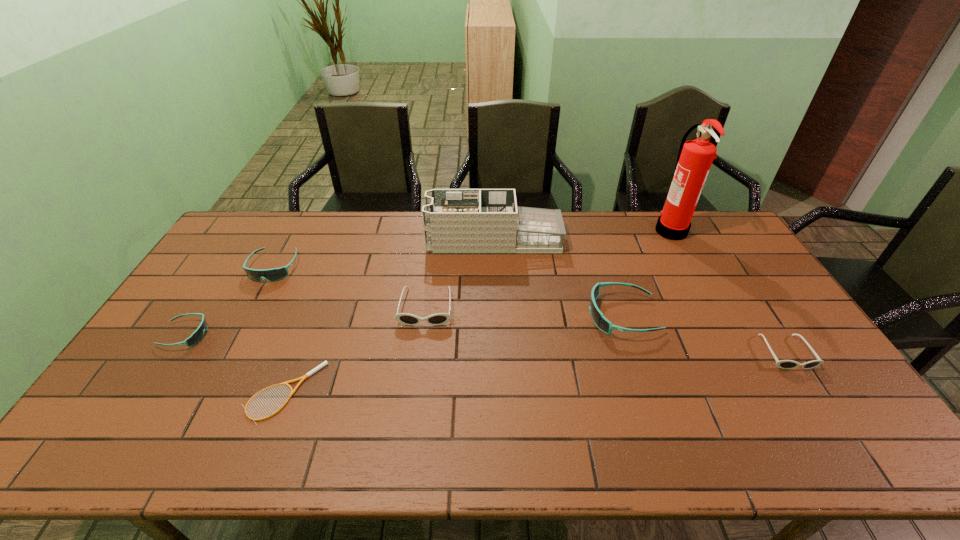
Identify the location of vacant area between the seventh shortest object and the leftmost object. The width and height of the screenshot is (960, 540). (340, 287).

Find the location of `vacant space that's between the beige tennis racket and the leftmost cyan sunglasses`. vacant space that's between the beige tennis racket and the leftmost cyan sunglasses is located at coordinates (235, 363).

The width and height of the screenshot is (960, 540). Identify the location of free space between the smallest cyan sunglasses and the fire extinguisher. (428, 282).

Where is `vacant area that lies between the bigger black sunglasses and the sixth object from right to left`? vacant area that lies between the bigger black sunglasses and the sixth object from right to left is located at coordinates (355, 350).

This screenshot has width=960, height=540. I want to click on free space that is in between the beige tennis racket and the seventh shortest object, so click(389, 316).

Identify the location of vacant area that lies between the second smallest cyan sunglasses and the dollhouse. Image resolution: width=960 pixels, height=540 pixels. (384, 254).

Locate an element on the screen. The height and width of the screenshot is (540, 960). unoccupied area between the sixth object from left to right and the dollhouse is located at coordinates (558, 278).

Identify the location of vacant area that lies between the tennis racket and the leftmost sunglasses. This screenshot has height=540, width=960. (235, 363).

Find the location of a particular element. This screenshot has height=540, width=960. blank region between the tennis racket and the tallest sunglasses is located at coordinates (453, 354).

Locate an element on the screen. The image size is (960, 540). object that is the closest to the second tallest object is located at coordinates (436, 319).